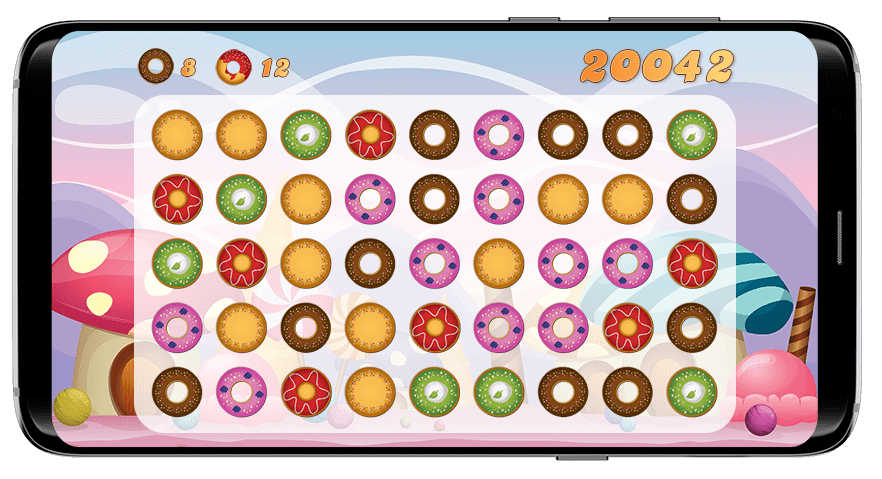
Find the location of `speaker`. speaker is located at coordinates (839, 233).